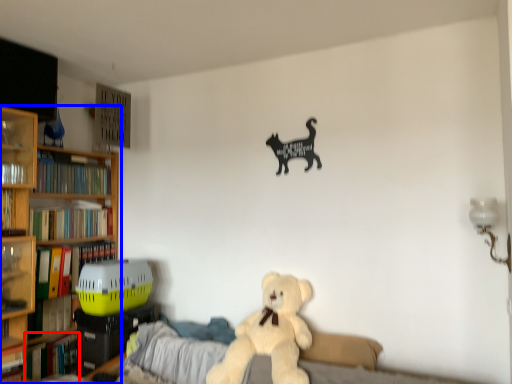
Question: Which object is further to the camera taking this photo, book (highlighted by a red box) or bookcase (highlighted by a blue box)?

Choices:
 (A) book
 (B) bookcase

Answer: (A)